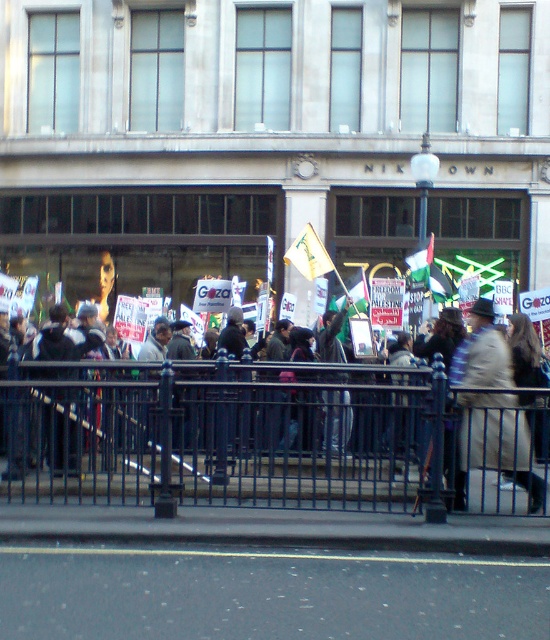
Measure the distance between point (x=354, y=460) and camera.

They are 13.55 meters apart.

Can you confirm if black metal fence at center is taller than dark gray hoodie at center?

Correct, black metal fence at center is much taller as dark gray hoodie at center.

Image resolution: width=550 pixels, height=640 pixels. In order to click on black metal fence at center in this screenshot , I will do `click(266, 436)`.

Is light brown leather coat at center to the right of dark gray hoodie at center from the viewer's perspective?

Correct, you'll find light brown leather coat at center to the right of dark gray hoodie at center.

Is light brown leather coat at center smaller than dark gray hoodie at center?

Incorrect, light brown leather coat at center is not smaller in size than dark gray hoodie at center.

Is point (519, 474) less distant than point (69, 461)?

Yes, point (519, 474) is in front of point (69, 461).

The width and height of the screenshot is (550, 640). In order to click on light brown leather coat at center in this screenshot , I will do `click(496, 444)`.

Who is more forward, (304,371) or (460,419)?

Point (460,419) is more forward.

Image resolution: width=550 pixels, height=640 pixels. I want to click on black metal fence at center, so click(x=266, y=436).